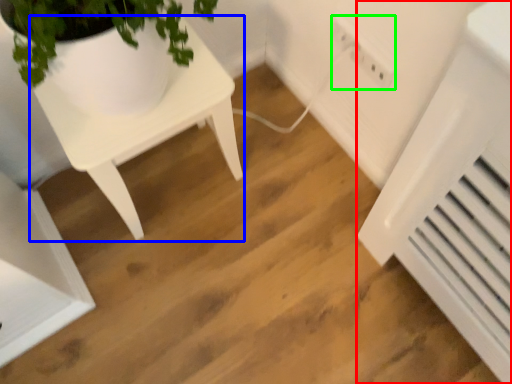
Question: Considering the real-world distances, which object is closest to air conditioning (highlighted by a red box)? table (highlighted by a blue box) or electric outlet (highlighted by a green box).

Choices:
 (A) table
 (B) electric outlet

Answer: (B)